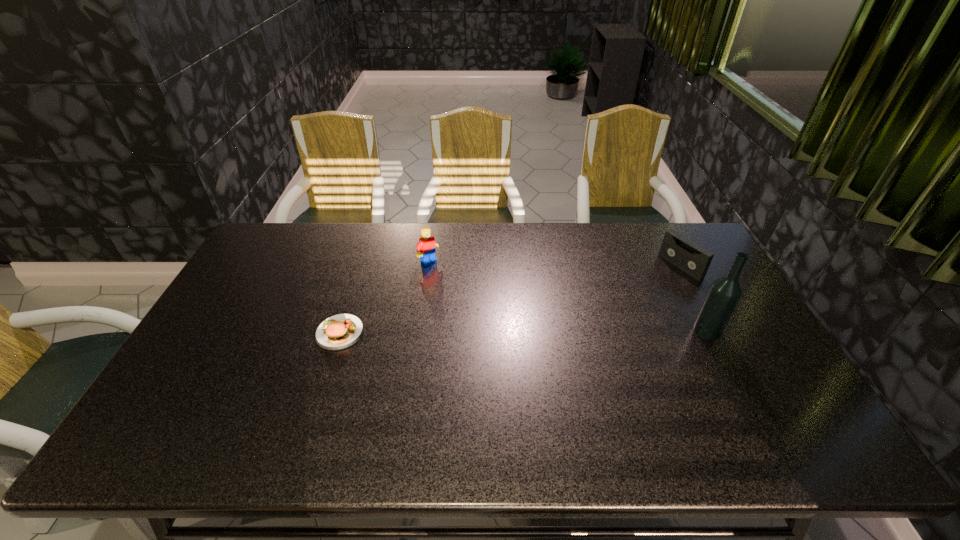
You are a GUI agent. You are given a task and a screenshot of the screen. Output one action in this format:
    pyautogui.click(x=<x>, y=<y>)
    Task: Click on the vacant space located 0.250m on the front-facing side of the videotape
    
    Given the screenshot: What is the action you would take?
    pyautogui.click(x=617, y=304)

The image size is (960, 540). What are the coordinates of `vacant space located 0.310m on the face of the Lego` in the screenshot? It's located at (503, 313).

In order to click on free point located on the face of the Lego in this screenshot , I will do `click(495, 308)`.

Locate an element on the screen. free space located on the face of the Lego is located at coordinates (482, 298).

Where is `videotape at the far edge`? videotape at the far edge is located at coordinates (677, 249).

The width and height of the screenshot is (960, 540). I want to click on Lego that is at the far edge, so click(x=426, y=249).

At what (x,y) coordinates should I click in order to perform the action: click on vodka present at the right edge. Please return your answer as a coordinate pair (x, y). The height and width of the screenshot is (540, 960). Looking at the image, I should click on (725, 292).

What are the coordinates of `videotape situated at the right edge` in the screenshot? It's located at (677, 249).

This screenshot has width=960, height=540. What are the coordinates of `object that is at the far right corner` in the screenshot? It's located at (677, 249).

This screenshot has height=540, width=960. Find the location of `blank space at the far edge`. blank space at the far edge is located at coordinates (621, 234).